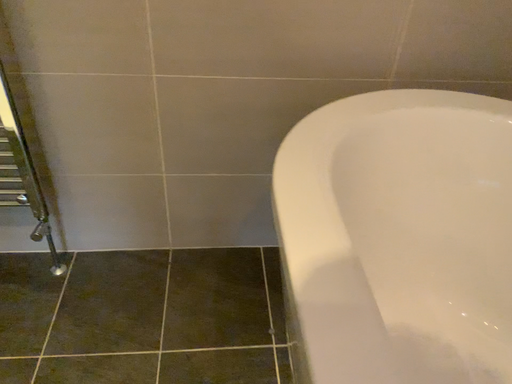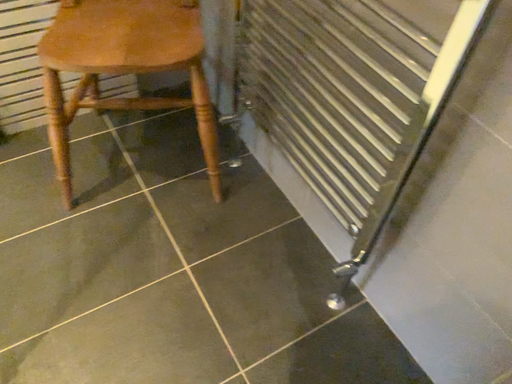
Question: How did the camera likely rotate when shooting the video?

Choices:
 (A) rotated upward
 (B) rotated downward

Answer: (A)